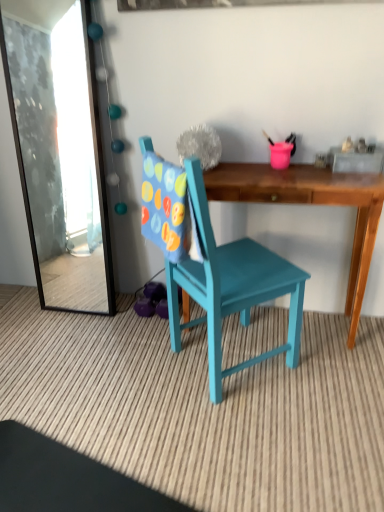
Question: From a real-world perspective, is transparent glass mirror at upper left on teal painted wood chair at center?

Choices:
 (A) no
 (B) yes

Answer: (B)

Question: Is transparent glass mirror at upper left looking in the opposite direction of teal painted wood chair at center?

Choices:
 (A) yes
 (B) no

Answer: (B)

Question: Is teal painted wood chair at center inside transparent glass mirror at upper left?

Choices:
 (A) yes
 (B) no

Answer: (B)

Question: From a real-world perspective, does transparent glass mirror at upper left sit lower than teal painted wood chair at center?

Choices:
 (A) no
 (B) yes

Answer: (A)

Question: Is transparent glass mirror at upper left located outside teal painted wood chair at center?

Choices:
 (A) yes
 (B) no

Answer: (A)

Question: From the image's perspective, is teal painted wood chair at center positioned above or below transparent glass mirror at upper left?

Choices:
 (A) above
 (B) below

Answer: (B)

Question: Looking at their shapes, would you say teal painted wood chair at center is wider or thinner than transparent glass mirror at upper left?

Choices:
 (A) wide
 (B) thin

Answer: (A)

Question: Considering the positions of teal painted wood chair at center and transparent glass mirror at upper left in the image, is teal painted wood chair at center bigger or smaller than transparent glass mirror at upper left?

Choices:
 (A) small
 (B) big

Answer: (B)

Question: From their relative heights in the image, would you say teal painted wood chair at center is taller or shorter than transparent glass mirror at upper left?

Choices:
 (A) short
 (B) tall

Answer: (B)

Question: Considering the positions of transparent glass mirror at upper left and wooden desk at center in the image, is transparent glass mirror at upper left wider or thinner than wooden desk at center?

Choices:
 (A) wide
 (B) thin

Answer: (B)

Question: From a real-world perspective, is transparent glass mirror at upper left positioned above or below wooden desk at center?

Choices:
 (A) below
 (B) above

Answer: (B)

Question: Considering the positions of point (56, 183) and point (297, 170), is point (56, 183) closer or farther from the camera than point (297, 170)?

Choices:
 (A) farther
 (B) closer

Answer: (A)

Question: From the image's perspective, is transparent glass mirror at upper left positioned above or below wooden desk at center?

Choices:
 (A) below
 (B) above

Answer: (B)

Question: Would you say wooden desk at center is inside or outside teal painted wood chair at center?

Choices:
 (A) inside
 (B) outside

Answer: (B)

Question: Relative to teal painted wood chair at center, is wooden desk at center in front or behind?

Choices:
 (A) front
 (B) behind

Answer: (B)